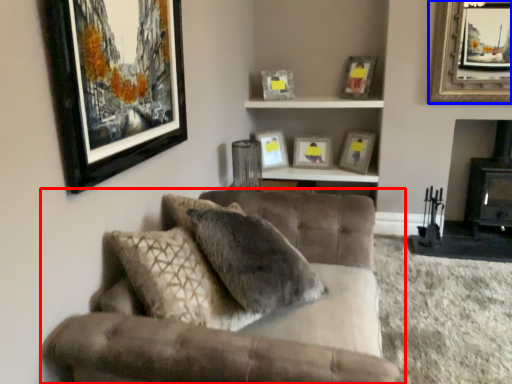
Question: Which object is closer to the camera taking this photo, studio couch (highlighted by a red box) or picture frame (highlighted by a blue box)?

Choices:
 (A) studio couch
 (B) picture frame

Answer: (A)